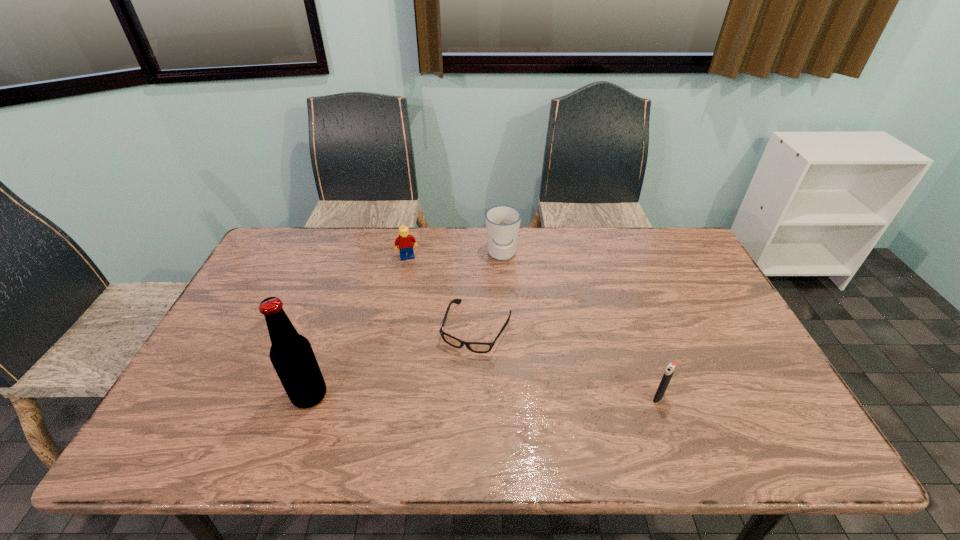
The height and width of the screenshot is (540, 960). I want to click on free spot on the desktop that is between the leftmost object and the igniter and is positioned with a handle on the side of the cup, so click(x=483, y=397).

This screenshot has height=540, width=960. I want to click on vacant space on the desktop that is between the leftmost object and the igniter and is positioned on the front-facing side of the spectacles, so click(447, 396).

Locate an element on the screen. free space on the desktop that is between the tallest object and the rightmost object and is positioned on the front-facing side of the second object from left to right is located at coordinates (449, 396).